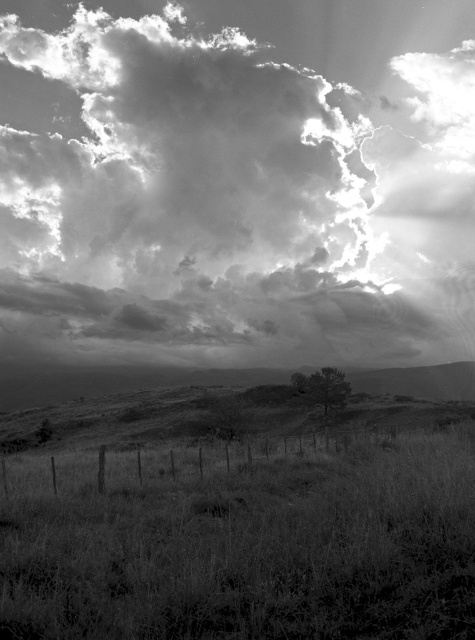
Question: Can you confirm if cloudy sky at upper center is bigger than grassy at lower center?

Choices:
 (A) no
 (B) yes

Answer: (B)

Question: Can you confirm if grassy at lower center is bigger than dark green textured tree at center?

Choices:
 (A) no
 (B) yes

Answer: (B)

Question: Is cloudy sky at upper center behind dark green textured tree at center?

Choices:
 (A) no
 (B) yes

Answer: (B)

Question: Which point is closer to the camera?

Choices:
 (A) dark green textured tree at center
 (B) cloudy sky at upper center

Answer: (A)

Question: Which point is closer to the camera taking this photo?

Choices:
 (A) (281, 20)
 (B) (437, 618)
 (C) (304, 396)

Answer: (B)

Question: Which point is closer to the camera?

Choices:
 (A) (127, 285)
 (B) (134, 620)
 (C) (292, 380)

Answer: (B)